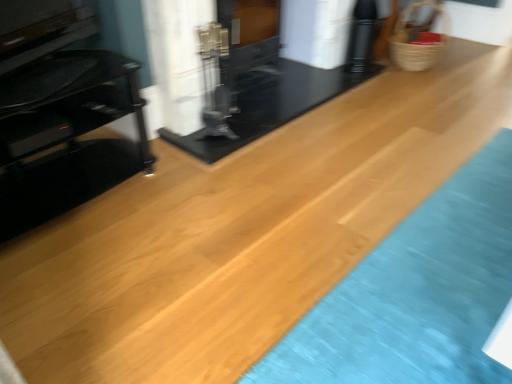
Question: Does point (233, 56) appear closer or farther from the camera than point (7, 72)?

Choices:
 (A) farther
 (B) closer

Answer: (A)

Question: Choose the correct answer: Is black glossy fireplace at center, the first fireplace viewed from the left, inside black glass tv stand at left or outside it?

Choices:
 (A) inside
 (B) outside

Answer: (B)

Question: Estimate the real-world distances between objects in this image. Which object is farther from the woven straw basket at upper right?

Choices:
 (A) black glossy fireplace at center, marked as the second fireplace in a left-to-right arrangement
 (B) black glossy fireplace at center, marked as the 2th fireplace in a right-to-left arrangement
 (C) black glass tv stand at left

Answer: (C)

Question: Which is nearer to the woven straw basket at upper right?

Choices:
 (A) black glossy fireplace at center, which is counted as the 1th fireplace, starting from the right
 (B) black glass tv stand at left
 (C) black glossy fireplace at center, marked as the 2th fireplace in a right-to-left arrangement

Answer: (A)